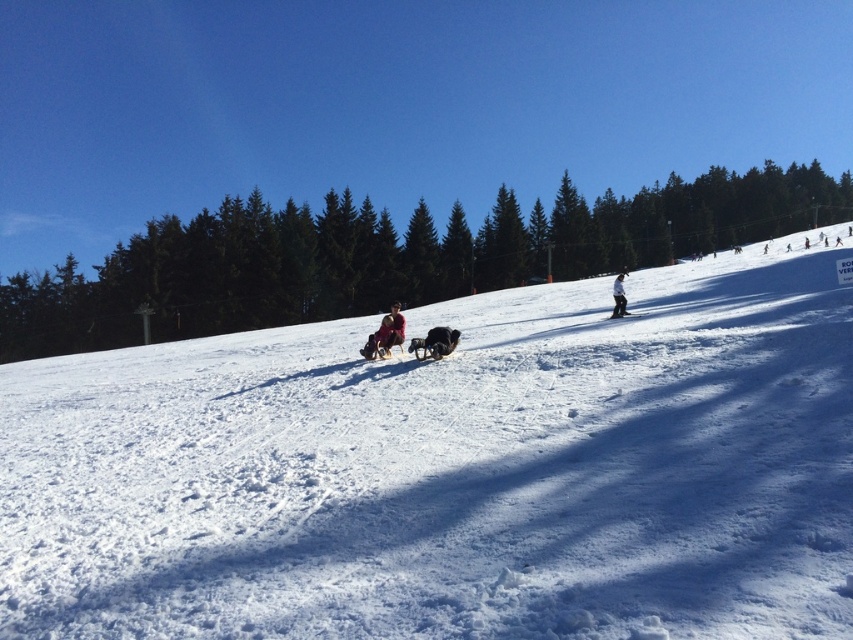
Question: Can you confirm if white fluffy snow at center is positioned above red fabric sled at center?

Choices:
 (A) yes
 (B) no

Answer: (A)

Question: Does white fluffy snow at center appear on the left side of soft brown fur at center?

Choices:
 (A) no
 (B) yes

Answer: (B)

Question: Among these objects, which one is nearest to the camera?

Choices:
 (A) white snowboarder at center
 (B) red fabric sled at center
 (C) white fluffy snow at center

Answer: (C)

Question: Is soft brown fur at center positioned at the back of red fabric sled at center?

Choices:
 (A) yes
 (B) no

Answer: (B)

Question: Which of these objects is positioned closest to the red fabric sled at center?

Choices:
 (A) white snowboarder at center
 (B) soft brown fur at center
 (C) white fluffy snow at center

Answer: (B)

Question: Which object appears closest to the camera in this image?

Choices:
 (A) soft brown fur at center
 (B) white snowboarder at center
 (C) white fluffy snow at center
 (D) red fabric sled at center

Answer: (C)